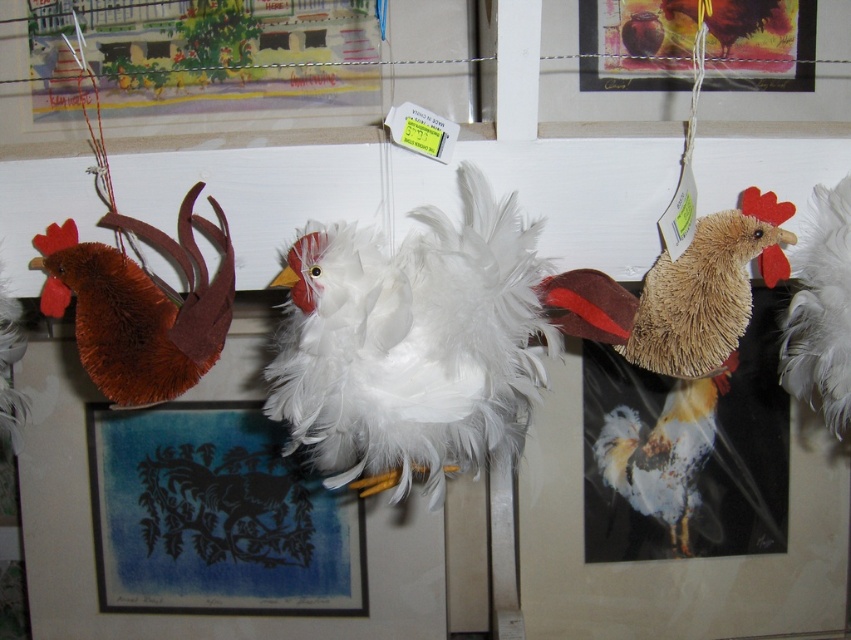
Question: Which object is farther from the camera taking this photo?

Choices:
 (A) white fluffy chicken at center
 (B) white feathered chicken at center

Answer: (A)

Question: Is white feathered chicken at center in front of white fluffy chicken at center?

Choices:
 (A) no
 (B) yes

Answer: (B)

Question: Can you confirm if brown fuzzy chicken at left is bigger than white fluffy chicken at center?

Choices:
 (A) no
 (B) yes

Answer: (A)

Question: Which is nearer to the white fluffy rooster at center?

Choices:
 (A) white fluffy chicken at center
 (B) brown fuzzy chicken at left
 (C) white feathered chicken at center

Answer: (A)

Question: Which of these objects is positioned closest to the white feathered chicken at center?

Choices:
 (A) bristled straw rooster at right
 (B) white fluffy chicken at center

Answer: (A)

Question: Is brown fuzzy chicken at left closer to the viewer compared to white fluffy rooster at center?

Choices:
 (A) yes
 (B) no

Answer: (A)